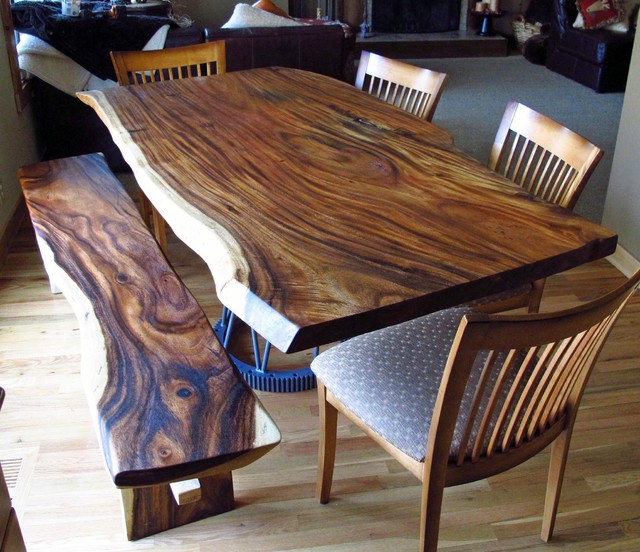
Image resolution: width=640 pixels, height=552 pixels. In order to click on hardwood floor in this screenshot , I will do `click(301, 525)`.